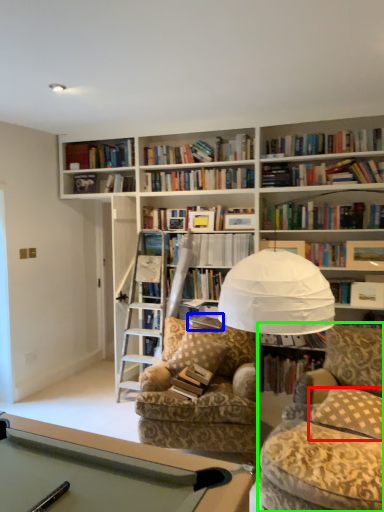
Question: Which object is the farthest from pillow (highlighted by a red box)? Choose among these: paperback book (highlighted by a blue box) or swivel chair (highlighted by a green box).

Choices:
 (A) paperback book
 (B) swivel chair

Answer: (A)